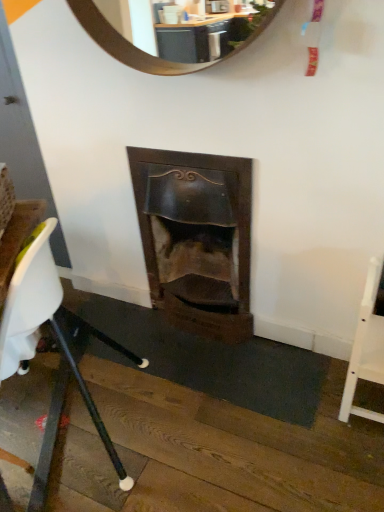
At what (x,y) coordinates should I click in order to perform the action: click on free space that is in between white plastic chair at lower left, which is the second chair in right-to-left order, and white wood chair at right, the first chair viewed from the right. Please return your answer as a coordinate pair (x, y). This screenshot has height=512, width=384. Looking at the image, I should click on (231, 407).